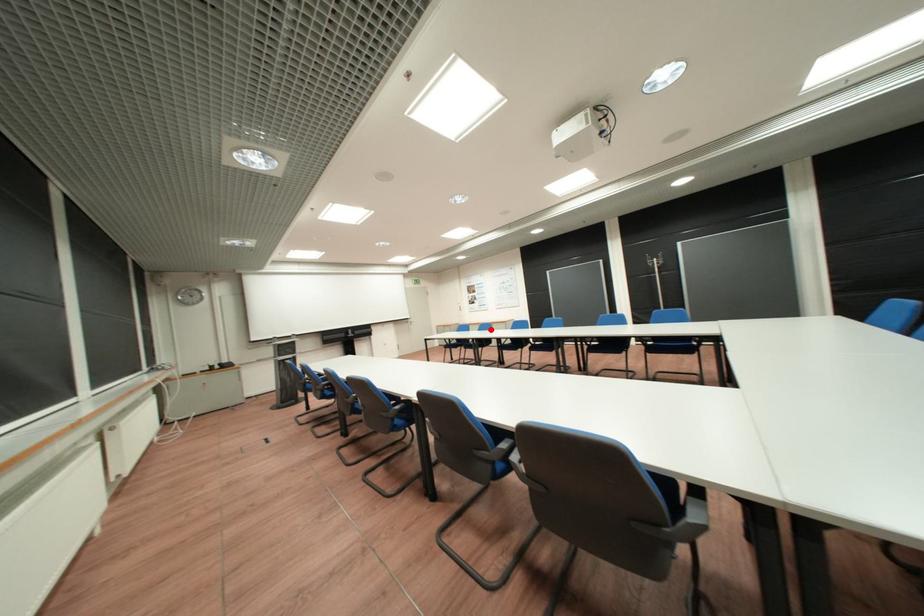
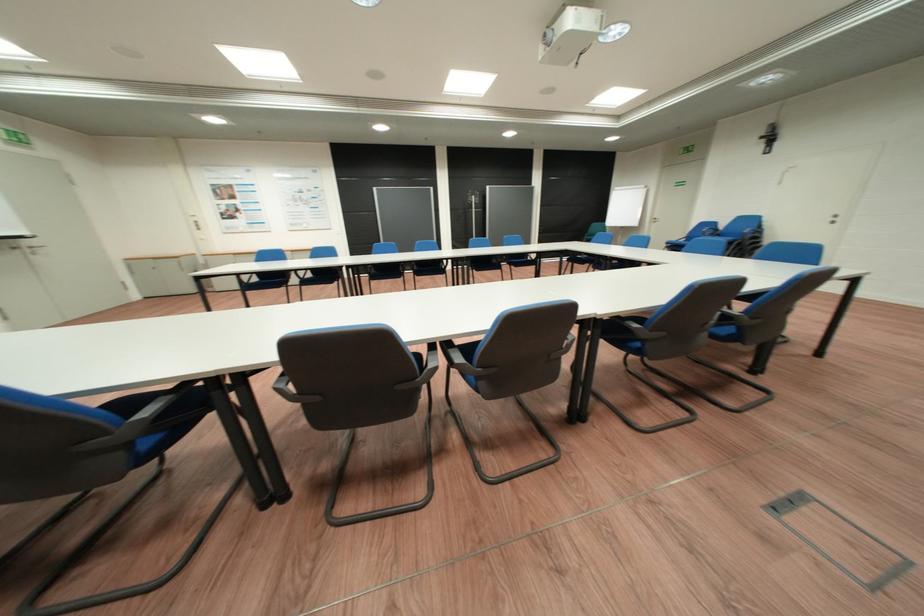
Question: A red point is marked in image1. In image2, is the corresponding 3D point closer to the camera or farther? Reply with the corresponding letter.

Choices:
 (A) The corresponding 3D point is closer.
 (B) The corresponding 3D point is farther.

Answer: (A)